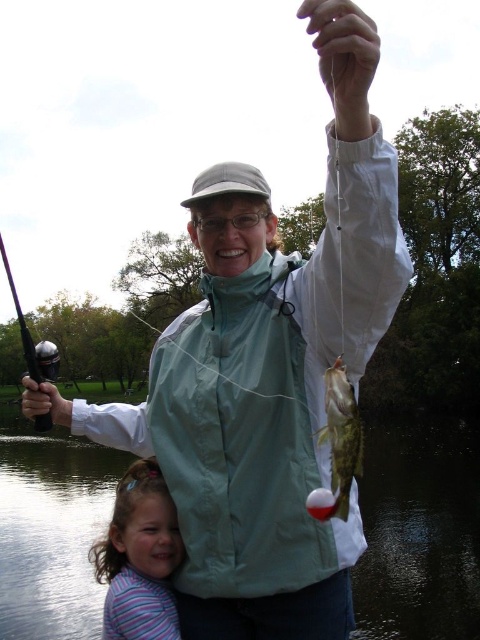
Does green fabric lake at center appear over greenish-yellow textured fish at center?

Actually, green fabric lake at center is below greenish-yellow textured fish at center.

Find the location of a particular element. green fabric lake at center is located at coordinates (420, 531).

Does point (145, 561) come farther from viewer compared to point (31, 337)?

No, (145, 561) is closer to viewer.

Between point (123, 490) and point (38, 413), which one is positioned in front?

Point (123, 490)

This screenshot has width=480, height=640. Identify the location of striped cotton shirt at lower left. (140, 557).

Who is more distant from viewer, (391,513) or (36,362)?

The point (391,513) is behind.

Where is `green fabric lake at center`? The height and width of the screenshot is (640, 480). green fabric lake at center is located at coordinates click(x=420, y=531).